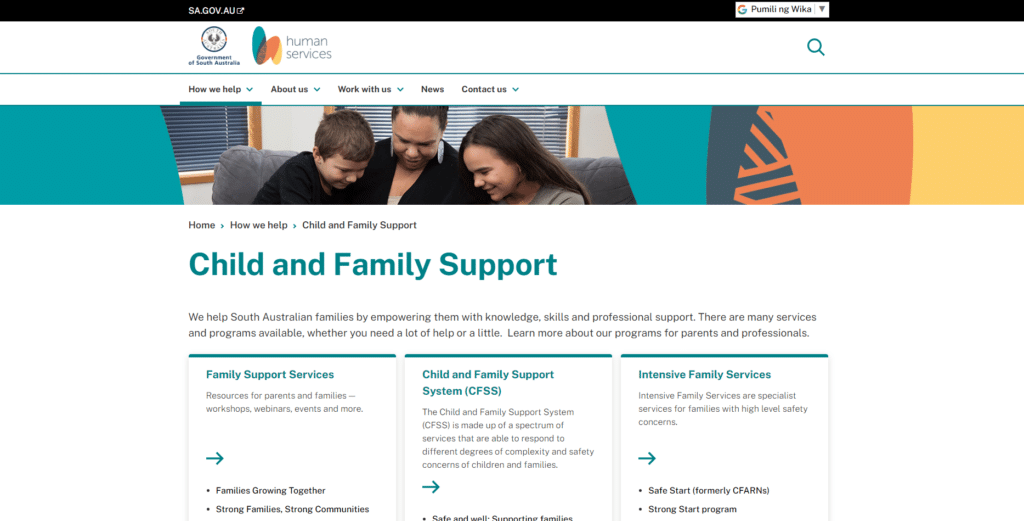
In order to click on blinds in this screenshot , I will do `click(374, 119)`, `click(202, 109)`, `click(539, 116)`.